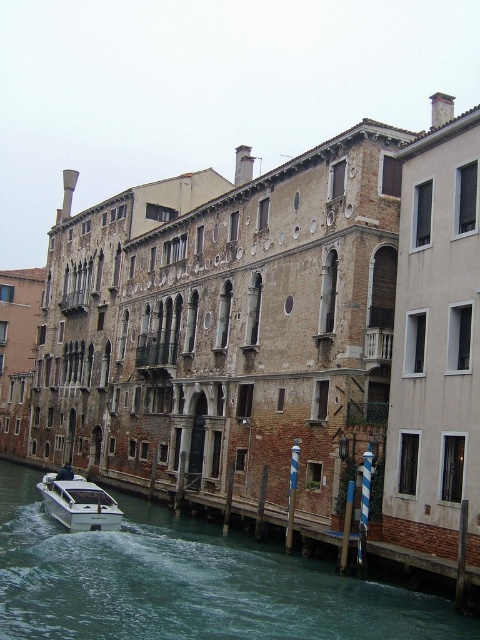
You are standing on the dock and want to check if the white glossy boat at lower left can reach the clear water at lower left. The boat requires at least 20 feet of clearance. Based on the scene, can it navigate safely?

The clear water at lower left is 25.40 feet away from the white glossy boat at lower left. Since the boat needs at least 20 feet of clearance, the 25.40 feet distance provides sufficient space for the boat to navigate safely.

You are standing on the canal bridge and see the clear water at lower left and the white glossy boat at lower left. Which one is closer to the bridge?

The white glossy boat at lower left is closer to the bridge because it is taller than the clear water at lower left, which is shorter.

You are a photographer planning to capture the historic building and both the clear water at lower left and white glossy boat at lower left in one frame. Which object should you focus on first to ensure they are both in the shot?

The white glossy boat at lower left should be focused on first because it occupies more space than the clear water at lower left, ensuring it is centered and properly framed before adjusting for the smaller area of clear water.